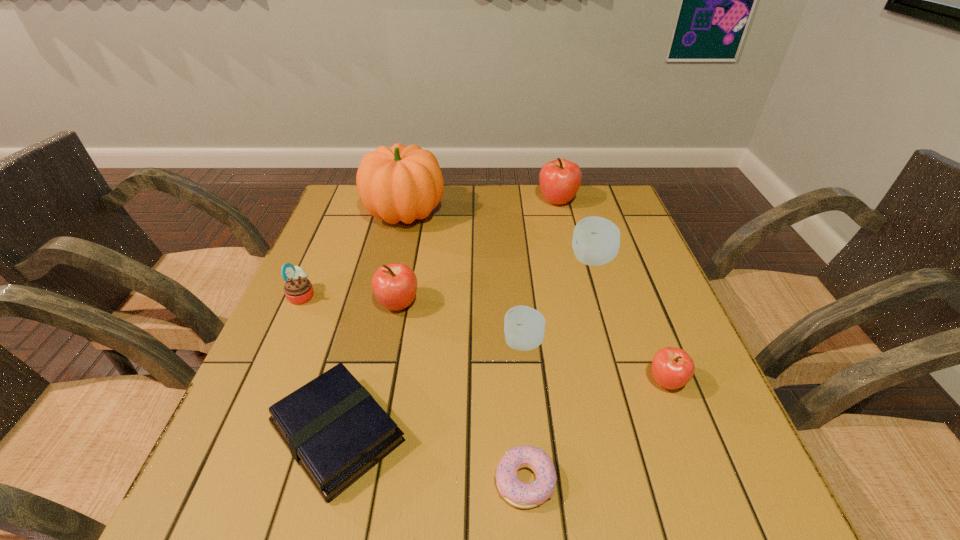
Image resolution: width=960 pixels, height=540 pixels. I want to click on free location located on the left of the right white apple, so click(497, 260).

I want to click on vacant space located 0.320m on the front of the leftmost pink apple, so click(x=368, y=458).

This screenshot has height=540, width=960. Find the location of `free space located on the front-facing side of the muffin`. free space located on the front-facing side of the muffin is located at coordinates (485, 296).

Identify the location of free space located 0.140m on the front of the sixth farthest object. (531, 421).

At what (x,y) coordinates should I click in order to perform the action: click on free space located 0.250m on the left of the smallest pink apple. Please return your answer as a coordinate pair (x, y). This screenshot has height=540, width=960. Looking at the image, I should click on (518, 382).

The height and width of the screenshot is (540, 960). Identify the location of vacant space located 0.360m on the right of the second shortest object. (611, 433).

The width and height of the screenshot is (960, 540). What are the coordinates of `vacant space situated 0.120m on the back of the pink doughnut` in the screenshot? It's located at (518, 392).

Locate an element on the screen. The height and width of the screenshot is (540, 960). pumpkin situated at the far edge is located at coordinates (400, 183).

I want to click on apple located at the far edge, so click(x=560, y=179).

Where is `book that is at the near edge`? The width and height of the screenshot is (960, 540). book that is at the near edge is located at coordinates (335, 430).